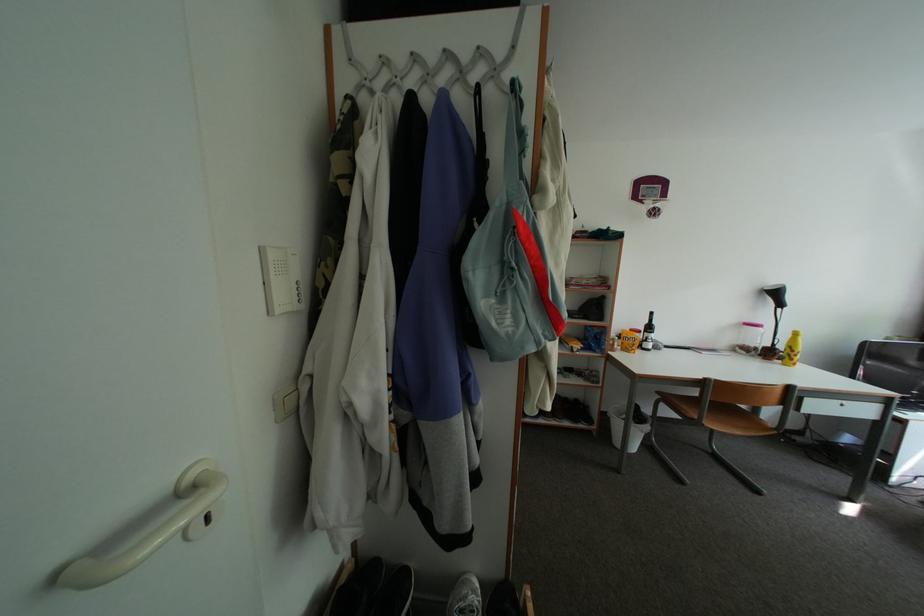
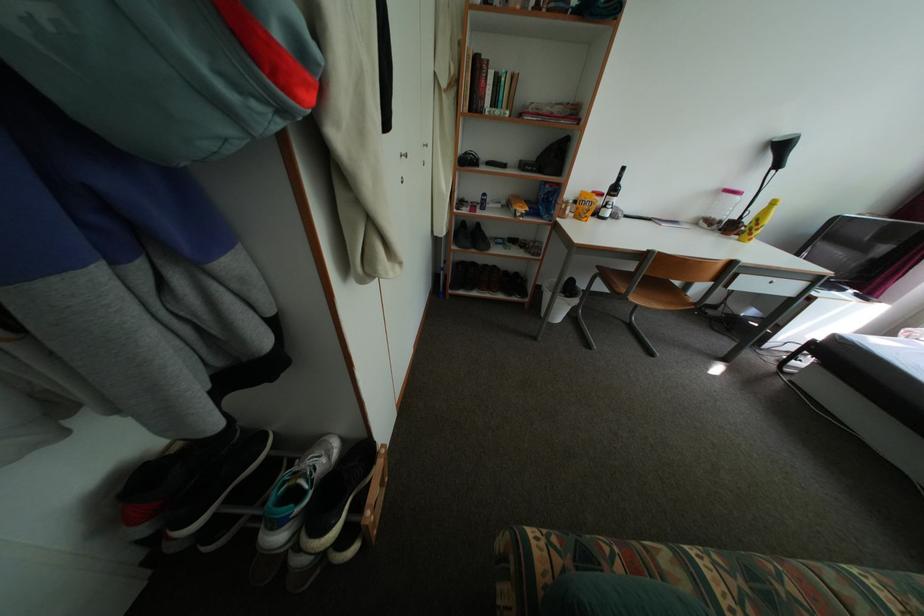
The images are taken continuously from a first-person perspective. In which direction are you moving?

The movement direction of the cameraman is right, forward.